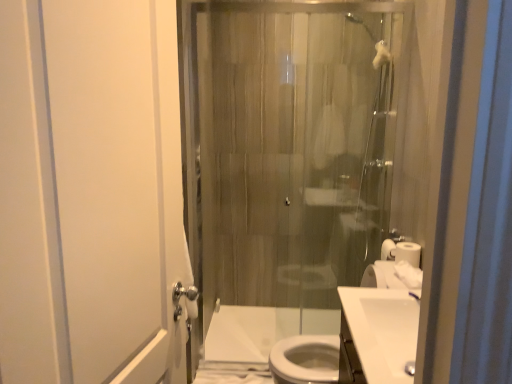
Question: From the image's perspective, is white glossy sink at center, which appears as the 1th sink when viewed from the back, above white glossy sink at lower right, which is the second sink from back to front?

Choices:
 (A) no
 (B) yes

Answer: (A)

Question: Does white glossy sink at center, which appears as the 1th sink when viewed from the back, lie behind white glossy sink at lower right, which is the second sink from back to front?

Choices:
 (A) no
 (B) yes

Answer: (B)

Question: Can you confirm if white glossy sink at center, which appears as the 1th sink when viewed from the back, is taller than white glossy sink at lower right, which is the second sink from back to front?

Choices:
 (A) yes
 (B) no

Answer: (A)

Question: Does white glossy sink at center, which appears as the 1th sink when viewed from the back, have a lesser height compared to white glossy sink at lower right, the first sink positioned from the front?

Choices:
 (A) yes
 (B) no

Answer: (B)

Question: Is white glossy sink at center, which appears as the 1th sink when viewed from the back, looking in the opposite direction of white glossy sink at lower right, which is the second sink from back to front?

Choices:
 (A) yes
 (B) no

Answer: (B)

Question: Is white glossy sink at center, which is the 2th sink from front to back, wider than white glossy sink at lower right, the first sink positioned from the front?

Choices:
 (A) no
 (B) yes

Answer: (B)

Question: Is white glossy toilet at lower center surrounded by white matte toilet paper at right?

Choices:
 (A) yes
 (B) no

Answer: (B)

Question: Considering the relative positions of white matte toilet paper at right and white glossy toilet at lower center in the image provided, is white matte toilet paper at right to the left of white glossy toilet at lower center from the viewer's perspective?

Choices:
 (A) no
 (B) yes

Answer: (A)

Question: Is white matte toilet paper at right positioned beyond the bounds of white glossy toilet at lower center?

Choices:
 (A) yes
 (B) no

Answer: (A)

Question: From the image's perspective, would you say white matte toilet paper at right is shown under white glossy toilet at lower center?

Choices:
 (A) yes
 (B) no

Answer: (B)

Question: Is white matte toilet paper at right wider than white glossy toilet at lower center?

Choices:
 (A) no
 (B) yes

Answer: (A)

Question: From a real-world perspective, is white matte toilet paper at right located higher than white glossy toilet at lower center?

Choices:
 (A) yes
 (B) no

Answer: (A)

Question: Is white glossy sink at lower right, the first sink positioned from the front, shorter than translucent glass shower door at center?

Choices:
 (A) no
 (B) yes

Answer: (B)